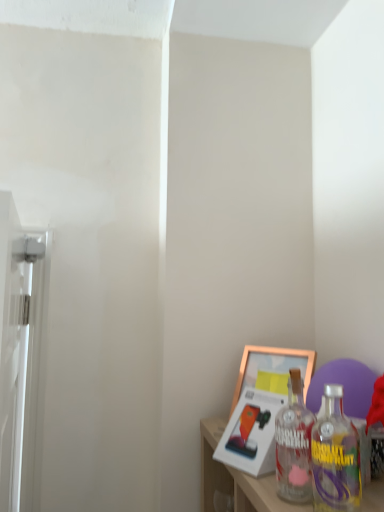
Question: Is there a large distance between clear glass bottle at lower right and white glossy screen door at left?

Choices:
 (A) no
 (B) yes

Answer: (A)

Question: Considering the relative positions of clear glass bottle at lower right and white glossy screen door at left in the image provided, is clear glass bottle at lower right to the left of white glossy screen door at left from the viewer's perspective?

Choices:
 (A) no
 (B) yes

Answer: (A)

Question: Does clear glass bottle at lower right lie in front of white glossy screen door at left?

Choices:
 (A) yes
 (B) no

Answer: (B)

Question: Can you confirm if clear glass bottle at lower right is smaller than white glossy screen door at left?

Choices:
 (A) yes
 (B) no

Answer: (A)

Question: From the image's perspective, is clear glass bottle at lower right under white glossy screen door at left?

Choices:
 (A) yes
 (B) no

Answer: (B)

Question: In terms of width, does gold metallic picture frame at lower right, arranged as the first picture frame when viewed from the back, look wider or thinner when compared to clear glass bottle at lower right?

Choices:
 (A) thin
 (B) wide

Answer: (A)

Question: Considering the positions of gold metallic picture frame at lower right, marked as the second picture frame in a front-to-back arrangement, and clear glass bottle at lower right in the image, is gold metallic picture frame at lower right, marked as the second picture frame in a front-to-back arrangement, taller or shorter than clear glass bottle at lower right?

Choices:
 (A) short
 (B) tall

Answer: (A)

Question: Is gold metallic picture frame at lower right, marked as the second picture frame in a front-to-back arrangement, inside or outside of clear glass bottle at lower right?

Choices:
 (A) outside
 (B) inside

Answer: (A)

Question: From a real-world perspective, is gold metallic picture frame at lower right, arranged as the first picture frame when viewed from the back, above or below clear glass bottle at lower right?

Choices:
 (A) below
 (B) above

Answer: (B)

Question: Visually, is gold metallic picture frame at lower right, acting as the 2th picture frame starting from the back, positioned to the left or to the right of clear glass bottle at lower right?

Choices:
 (A) right
 (B) left

Answer: (B)

Question: From the image's perspective, is gold metallic picture frame at lower right, which is counted as the first picture frame, starting from the front, located above or below clear glass bottle at lower right?

Choices:
 (A) above
 (B) below

Answer: (B)

Question: Is point tap(273, 457) closer or farther from the camera than point tap(291, 482)?

Choices:
 (A) closer
 (B) farther

Answer: (B)

Question: Is gold metallic picture frame at lower right, which is counted as the first picture frame, starting from the front, wider or thinner than clear glass bottle at lower right?

Choices:
 (A) thin
 (B) wide

Answer: (B)

Question: Do you think white glossy screen door at left is within clear glass bottle at lower right, or outside of it?

Choices:
 (A) inside
 (B) outside

Answer: (B)

Question: Considering their positions, is white glossy screen door at left located in front of or behind clear glass bottle at lower right?

Choices:
 (A) front
 (B) behind

Answer: (A)